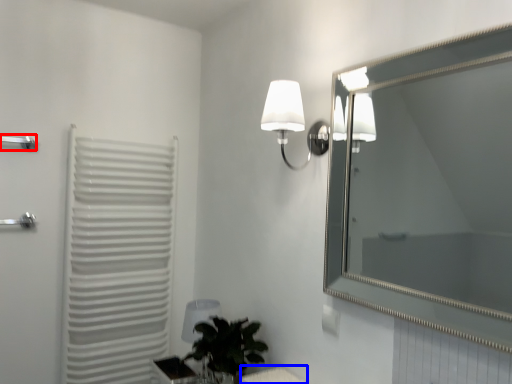
Question: Which of the following is the closest to the observer, towel bar (highlighted by a red box) or table (highlighted by a blue box)?

Choices:
 (A) towel bar
 (B) table

Answer: (B)